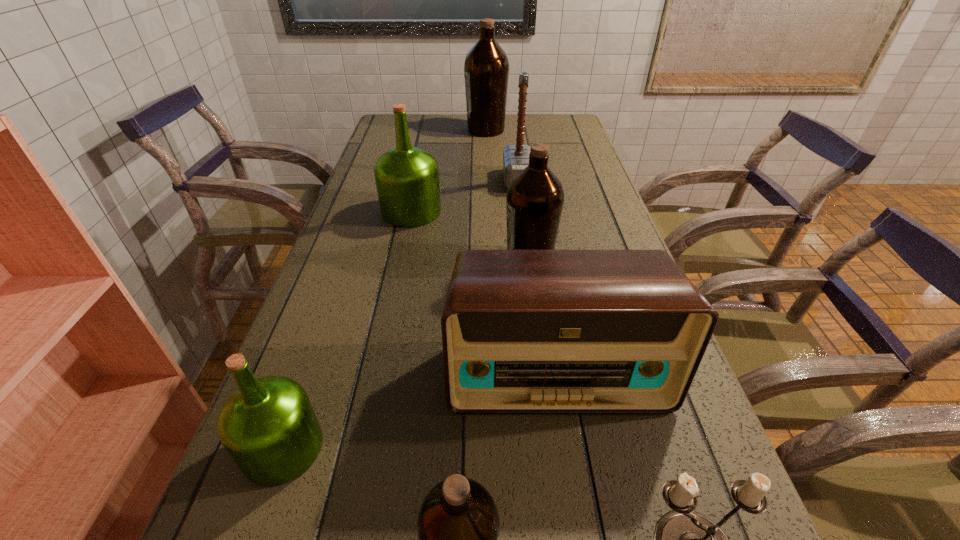
Locate an element on the screen. This screenshot has height=540, width=960. the nearer green olive oil is located at coordinates (268, 426).

Locate an element on the screen. Image resolution: width=960 pixels, height=540 pixels. free space located on the label of the biggest brown olive oil is located at coordinates (439, 130).

You are a GUI agent. You are given a task and a screenshot of the screen. Output one action in this format:
    pyautogui.click(x=<x>, y=<y>)
    Task: Click on the blank area located on the label of the biggest brown olive oil
    This screenshot has width=960, height=540.
    Given the screenshot: What is the action you would take?
    pos(439,130)

Identify the location of vacant space located on the label of the biggest brown olive oil. The image size is (960, 540). (384, 130).

Where is `free space located on the striking surface of the seventh nearest object`? The height and width of the screenshot is (540, 960). free space located on the striking surface of the seventh nearest object is located at coordinates (379, 181).

Image resolution: width=960 pixels, height=540 pixels. Find the location of `blank area located on the striking surface of the seventh nearest object`. blank area located on the striking surface of the seventh nearest object is located at coordinates (459, 181).

At what (x,y) coordinates should I click in order to perform the action: click on vacant space located 0.270m on the striking surface of the seventh nearest object. Please return your answer as a coordinate pair (x, y). Image resolution: width=960 pixels, height=540 pixels. Looking at the image, I should click on (418, 181).

Where is `vacant space located 0.090m on the right of the farther green olive oil`? The width and height of the screenshot is (960, 540). vacant space located 0.090m on the right of the farther green olive oil is located at coordinates click(x=472, y=211).

Identify the location of vacant space located 0.060m on the label of the third farthest olive oil. (479, 261).

Locate an element on the screen. vacant area situated on the label of the third farthest olive oil is located at coordinates (471, 261).